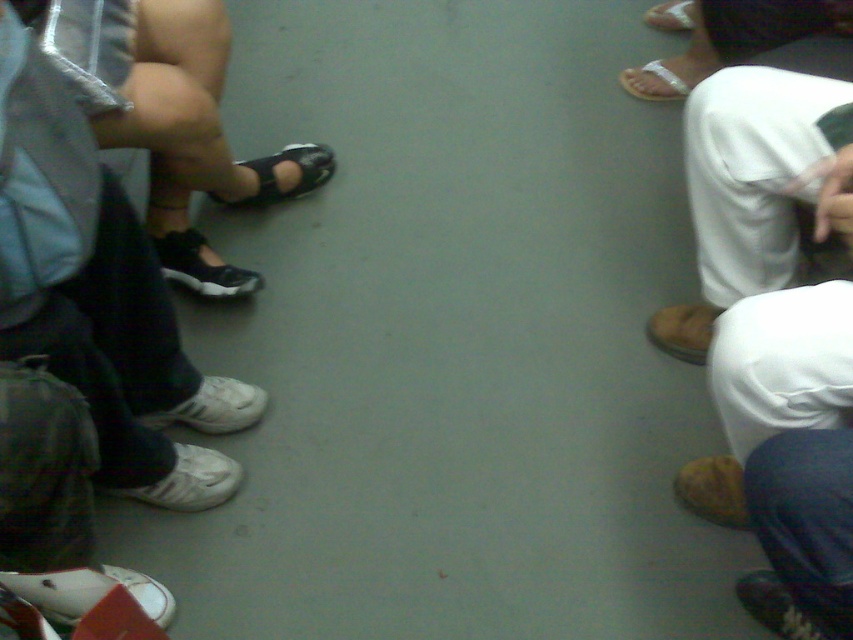
Between black leather sandal at center-left and clear plastic sandal at upper right, which one appears on the left side from the viewer's perspective?

black leather sandal at center-left

Can you confirm if black leather sandal at center-left is positioned to the right of clear plastic sandal at upper right?

Incorrect, black leather sandal at center-left is not on the right side of clear plastic sandal at upper right.

Is point (305, 148) closer to camera compared to point (636, 92)?

Yes, point (305, 148) is closer to viewer.

In order to click on black leather sandal at center-left in this screenshot , I will do `click(276, 179)`.

Does black leather sandal at center-left have a lesser width compared to brown leather sandal at upper right?

No, black leather sandal at center-left is not thinner than brown leather sandal at upper right.

Is black leather sandal at center-left smaller than brown leather sandal at upper right?

No, black leather sandal at center-left is not smaller than brown leather sandal at upper right.

Locate an element on the screen. The image size is (853, 640). black leather sandal at center-left is located at coordinates (276, 179).

Find the location of a particular element. The width and height of the screenshot is (853, 640). black leather sandal at center-left is located at coordinates (276, 179).

Is clear plastic sandal at upper right below brown leather sandal at upper right?

Indeed, clear plastic sandal at upper right is positioned under brown leather sandal at upper right.

Who is more forward, (630, 67) or (688, 1)?

Point (630, 67) is in front.

Between point (630, 74) and point (675, 12), which one is positioned in front?

Point (630, 74)

The width and height of the screenshot is (853, 640). In order to click on clear plastic sandal at upper right in this screenshot , I will do `click(669, 74)`.